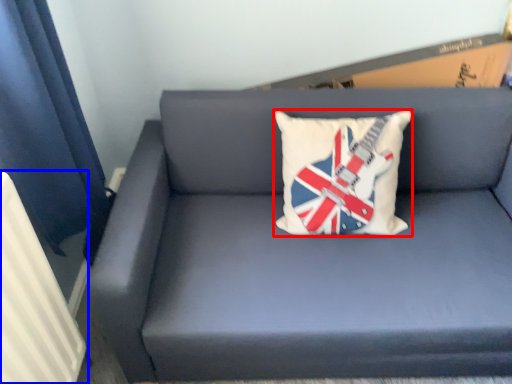
Question: Which object appears farthest to the camera in this image, pillow (highlighted by a red box) or radiator (highlighted by a blue box)?

Choices:
 (A) pillow
 (B) radiator

Answer: (A)